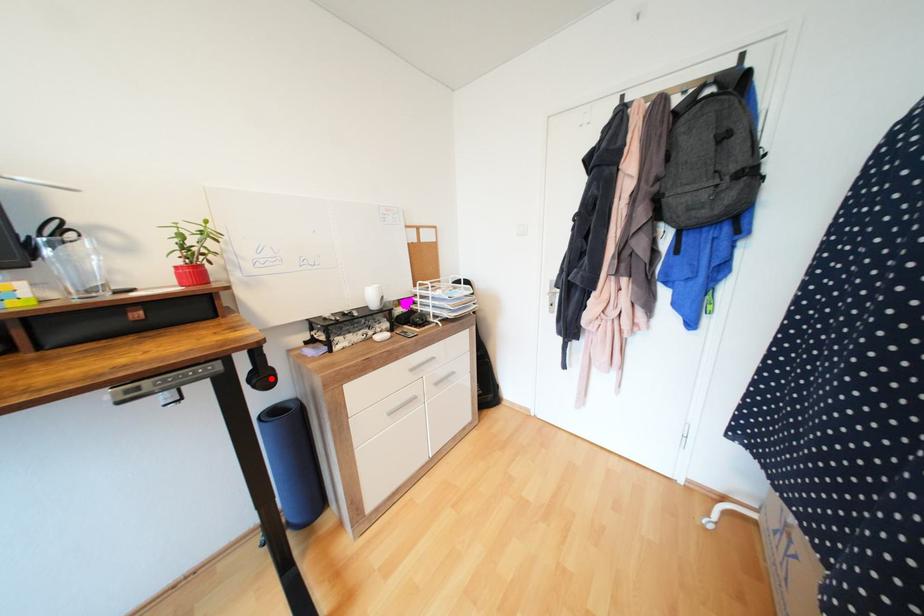
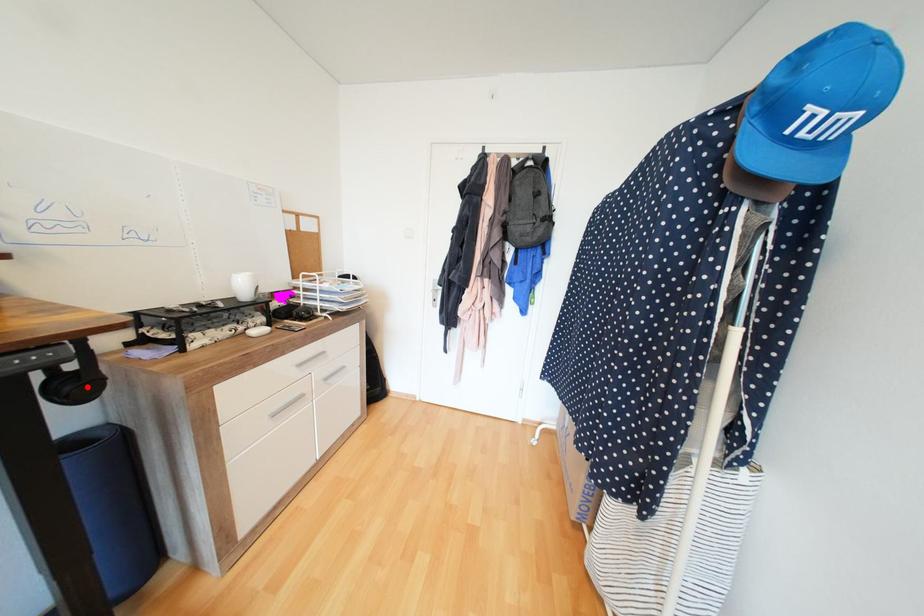
I am providing you with two images of the same scene from different viewpoints. A red point is marked on the first image and another point is marked on the second image. Is the marked point in image1 the same physical position as the marked point in image2?

Yes